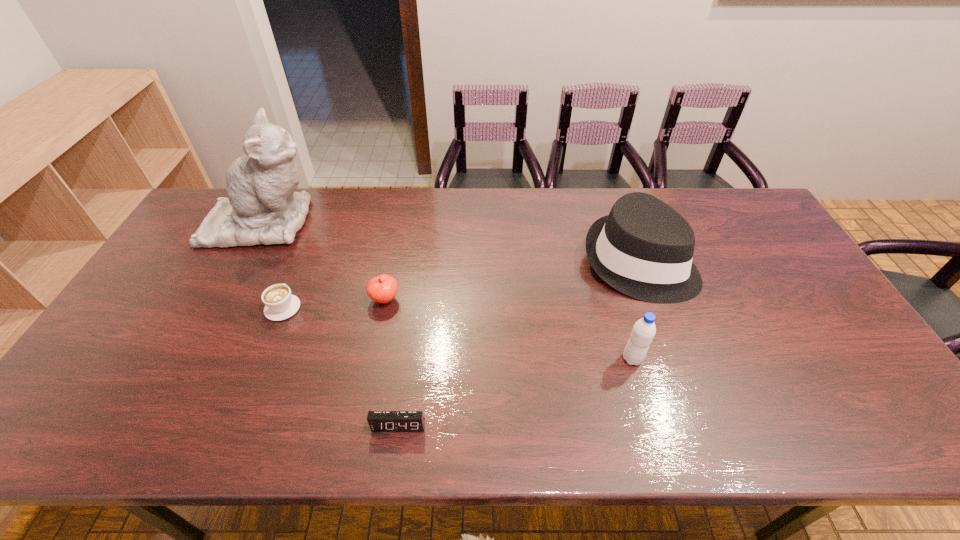
The image size is (960, 540). In order to click on free spot that satisfies the following two spatial constraints: 1. to the right of the fedora's handle; 2. on the right side of the cappuccino in this screenshot , I will do `click(301, 262)`.

Identify the location of vacant space that satisfies the following two spatial constraints: 1. to the right of the fedora's handle; 2. on the left side of the cappuccino. The width and height of the screenshot is (960, 540). (301, 262).

Find the location of a particular element. The height and width of the screenshot is (540, 960). vacant point that satisfies the following two spatial constraints: 1. on the front-facing side of the cat; 2. on the back side of the fedora is located at coordinates coord(243,262).